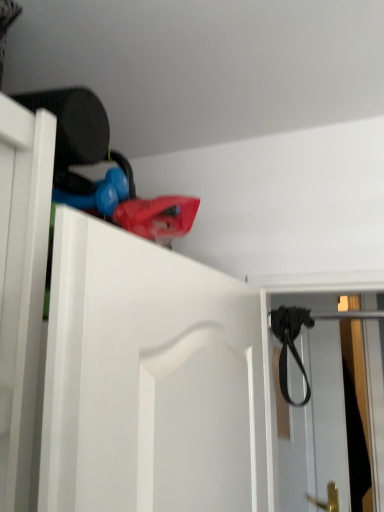
Question: Is black rubber strap at upper right oriented away from black leather strap at upper right?

Choices:
 (A) yes
 (B) no

Answer: (B)

Question: Considering the relative sizes of black rubber strap at upper right and black leather strap at upper right in the image provided, is black rubber strap at upper right thinner than black leather strap at upper right?

Choices:
 (A) yes
 (B) no

Answer: (B)

Question: Does black rubber strap at upper right appear on the left side of black leather strap at upper right?

Choices:
 (A) no
 (B) yes

Answer: (A)

Question: Does black rubber strap at upper right have a larger size compared to black leather strap at upper right?

Choices:
 (A) yes
 (B) no

Answer: (A)

Question: Is the depth of black rubber strap at upper right greater than that of black leather strap at upper right?

Choices:
 (A) yes
 (B) no

Answer: (A)

Question: From the image's perspective, is black rubber strap at upper right under black leather strap at upper right?

Choices:
 (A) no
 (B) yes

Answer: (B)

Question: From a real-world perspective, is black leather strap at upper right positioned under black rubber strap at upper right based on gravity?

Choices:
 (A) no
 (B) yes

Answer: (A)

Question: Is black leather strap at upper right surrounding black rubber strap at upper right?

Choices:
 (A) no
 (B) yes

Answer: (A)

Question: Is black leather strap at upper right oriented away from black rubber strap at upper right?

Choices:
 (A) yes
 (B) no

Answer: (A)

Question: Does black leather strap at upper right have a smaller size compared to black rubber strap at upper right?

Choices:
 (A) yes
 (B) no

Answer: (A)

Question: Does black leather strap at upper right have a greater height compared to black rubber strap at upper right?

Choices:
 (A) no
 (B) yes

Answer: (A)

Question: Is black leather strap at upper right not within black rubber strap at upper right?

Choices:
 (A) yes
 (B) no

Answer: (A)

Question: Based on their positions, is black rubber strap at upper right located to the left or right of black leather strap at upper right?

Choices:
 (A) left
 (B) right

Answer: (B)